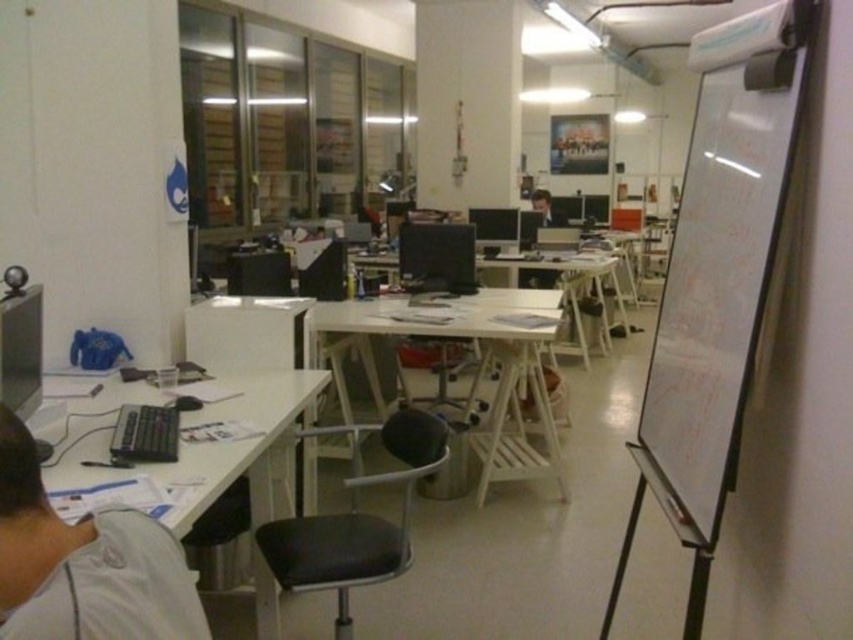
Question: Which point is closer to the camera taking this photo?

Choices:
 (A) (666, 461)
 (B) (161, 620)

Answer: (B)

Question: Considering the real-world distances, which object is farthest from the white plastic table at lower left?

Choices:
 (A) matte black monitor at center
 (B) white wood computer desk at center
 (C) black leather swivel chair at center

Answer: (A)

Question: Does black leather swivel chair at center have a lesser width compared to white plastic table at center?

Choices:
 (A) yes
 (B) no

Answer: (A)

Question: Can you confirm if gray fabric shirt at lower left is positioned to the left of white wood computer desk at center?

Choices:
 (A) yes
 (B) no

Answer: (A)

Question: Which object is farther from the camera taking this photo?

Choices:
 (A) white matte whiteboard at right
 (B) white plastic table at lower left
 (C) black leather swivel chair at center

Answer: (C)

Question: From the image, what is the correct spatial relationship of white matte whiteboard at right in relation to white plastic table at center?

Choices:
 (A) below
 (B) above

Answer: (A)